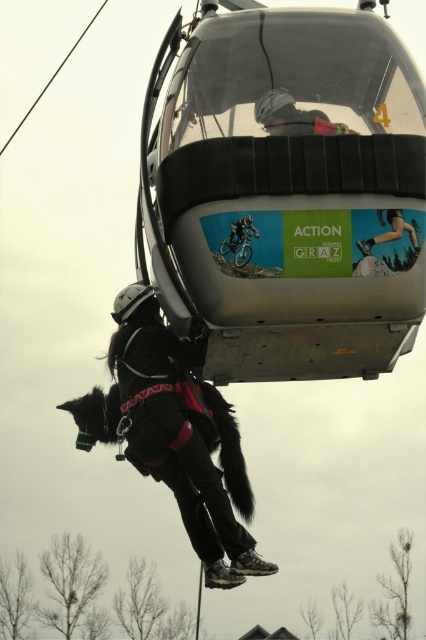
Does dark gray fabric jacket at upper center have a lesser width compared to smooth skin at center?

Incorrect, dark gray fabric jacket at upper center's width is not less than smooth skin at center's.

Does dark gray fabric jacket at upper center have a smaller size compared to smooth skin at center?

No.

Between point (325, 125) and point (386, 218), which one is positioned behind?

Positioned behind is point (325, 125).

Where is `dark gray fabric jacket at upper center`? The height and width of the screenshot is (640, 426). dark gray fabric jacket at upper center is located at coordinates (293, 116).

Who is higher up, black matte/soft material jacket at lower center or dark gray fabric jacket at upper center?

dark gray fabric jacket at upper center

Is black matte/soft material jacket at lower center below dark gray fabric jacket at upper center?

Correct, black matte/soft material jacket at lower center is located below dark gray fabric jacket at upper center.

Identify the location of black matte/soft material jacket at lower center. This screenshot has height=640, width=426. (175, 435).

Which of these two, silver metallic cable car at upper center or black matte/soft material jacket at lower center, stands taller?

silver metallic cable car at upper center is taller.

Is point (155, 259) positioned after point (196, 516)?

That is False.

Locate an element on the screen. silver metallic cable car at upper center is located at coordinates coord(282,189).